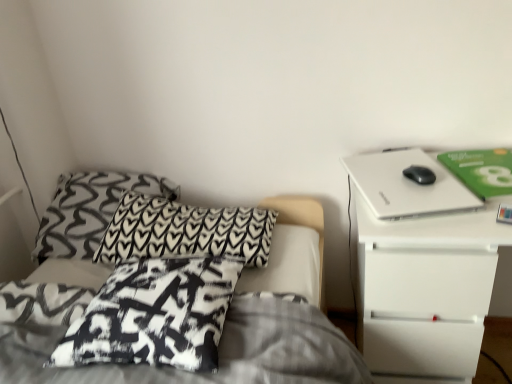
Question: Can you confirm if white matte nightstand at right is thinner than black printed fabric pillow at upper left, acting as the 2th pillow starting from the front?

Choices:
 (A) no
 (B) yes

Answer: (B)

Question: From the image's perspective, is white matte nightstand at right located beneath black printed fabric pillow at upper left, acting as the 2th pillow starting from the front?

Choices:
 (A) no
 (B) yes

Answer: (B)

Question: Is the position of white matte nightstand at right less distant than that of black printed fabric pillow at upper left, which ranks as the second pillow in back-to-front order?

Choices:
 (A) no
 (B) yes

Answer: (B)

Question: Is white matte nightstand at right positioned with its back to black printed fabric pillow at upper left, acting as the 2th pillow starting from the front?

Choices:
 (A) yes
 (B) no

Answer: (B)

Question: Does white matte nightstand at right have a greater height compared to black printed fabric pillow at upper left, which ranks as the second pillow in back-to-front order?

Choices:
 (A) yes
 (B) no

Answer: (A)

Question: Does white matte nightstand at right contain black printed fabric pillow at upper left, which ranks as the second pillow in back-to-front order?

Choices:
 (A) no
 (B) yes

Answer: (A)

Question: Considering the relative sizes of black printed pillow at center, which appears as the 3th pillow when viewed from the back, and white matte nightstand at right in the image provided, is black printed pillow at center, which appears as the 3th pillow when viewed from the back, wider than white matte nightstand at right?

Choices:
 (A) no
 (B) yes

Answer: (A)

Question: From the image's perspective, is black printed pillow at center, which appears as the 3th pillow when viewed from the back, located above white matte nightstand at right?

Choices:
 (A) no
 (B) yes

Answer: (B)

Question: Does black printed pillow at center, arranged as the 1th pillow when viewed from the front, come in front of white matte nightstand at right?

Choices:
 (A) no
 (B) yes

Answer: (B)

Question: Considering the relative sizes of black printed pillow at center, arranged as the 1th pillow when viewed from the front, and white matte nightstand at right in the image provided, is black printed pillow at center, arranged as the 1th pillow when viewed from the front, taller than white matte nightstand at right?

Choices:
 (A) no
 (B) yes

Answer: (A)

Question: Does black printed pillow at center, arranged as the 1th pillow when viewed from the front, touch white matte nightstand at right?

Choices:
 (A) no
 (B) yes

Answer: (A)

Question: Could white matte nightstand at right be considered to be inside black printed pillow at center, which appears as the 3th pillow when viewed from the back?

Choices:
 (A) yes
 (B) no

Answer: (B)

Question: Is white matte laptop at upper right aimed at black printed pillow at center, arranged as the 1th pillow when viewed from the front?

Choices:
 (A) yes
 (B) no

Answer: (B)